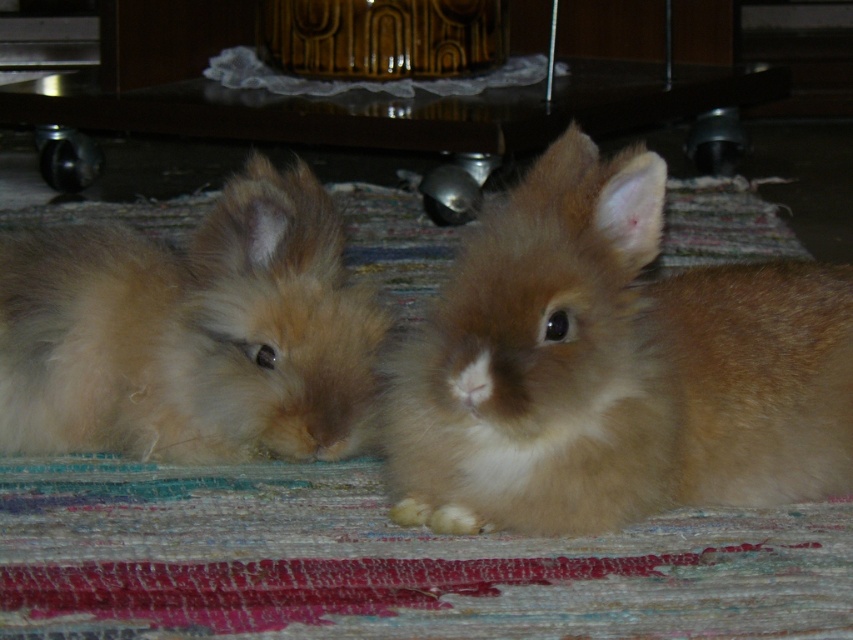
Does fuzzy brown rabbit at center appear under fuzzy brown rabbit at left?

Yes.

Which is more to the right, fuzzy brown rabbit at center or fuzzy brown rabbit at left?

fuzzy brown rabbit at center is more to the right.

Does point (788, 429) come closer to viewer compared to point (318, 336)?

Yes, it is.

I want to click on fuzzy brown rabbit at center, so tap(613, 368).